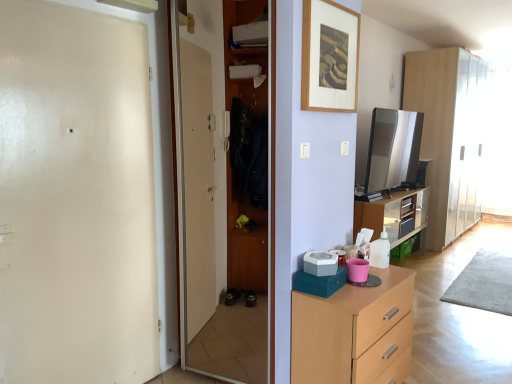
The width and height of the screenshot is (512, 384). Identify the location of blank space situated above wooden picture frame at upper center (from a real-world perspective). tap(337, 4).